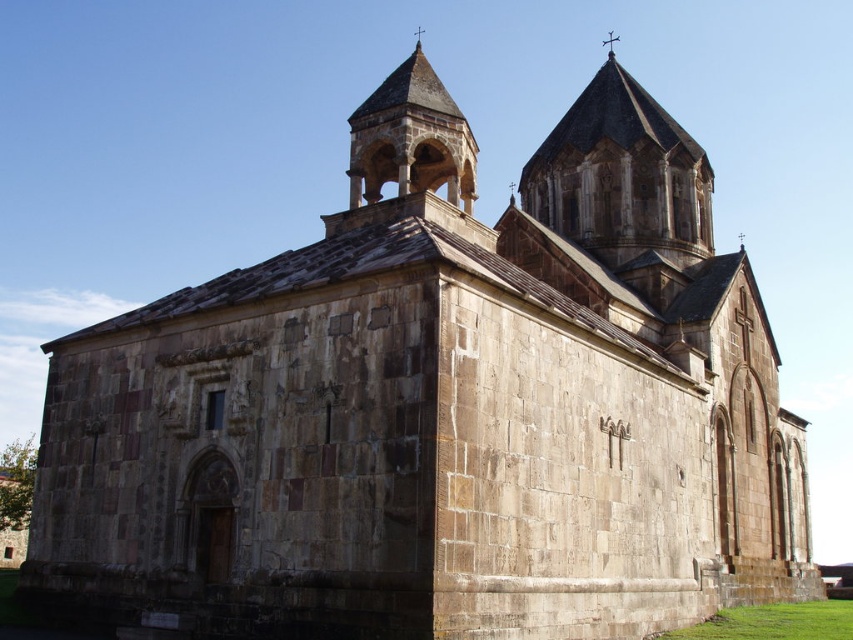
You are a visitor standing in front of the historic stone church. You notice two towers. The first is the stone tower at upper center, and the second is the stone arched tower at center. Which tower appears wider from your viewing position?

The stone tower at upper center might be wider than the stone arched tower at center according to the description provided.

You are standing in front of the historic stone church and notice two towers. The first is the stone tower at upper center, and the second is the stone arched tower at center. From your perspective, which tower is positioned to the right side?

The stone tower at upper center is positioned to the right of the stone arched tower at center, so the stone tower at upper center is the one on the right side.